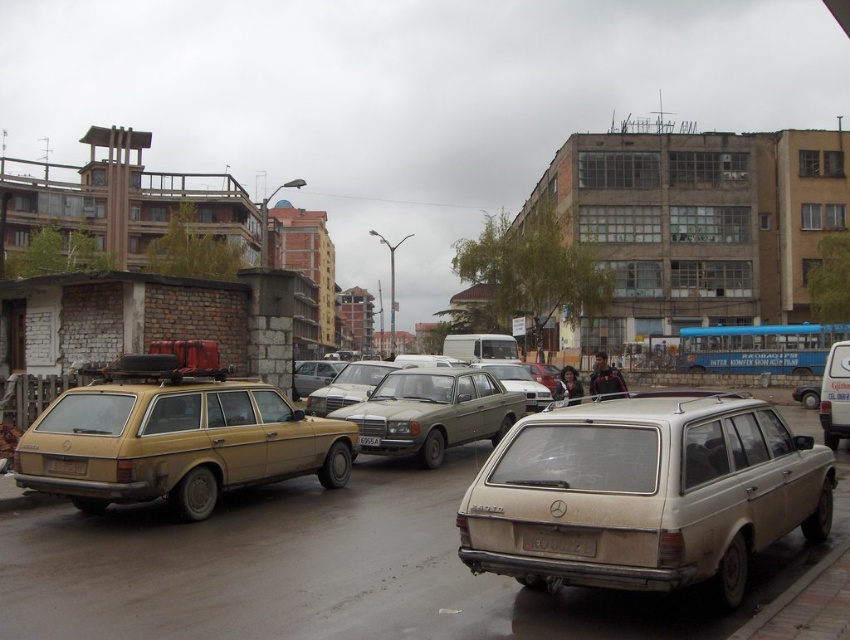
Looking at this image, who is higher up, black plastic license plate at center or metallic silver sedan at center?

black plastic license plate at center is higher up.

Can you confirm if black plastic license plate at center is positioned below metallic silver sedan at center?

Actually, black plastic license plate at center is above metallic silver sedan at center.

Image resolution: width=850 pixels, height=640 pixels. What are the coordinates of `black plastic license plate at center` in the screenshot? It's located at (558, 540).

Is green matte sedan at center shorter than silver metallic sedan at center?

Correct, green matte sedan at center is not as tall as silver metallic sedan at center.

In the scene shown: Is green matte sedan at center to the right of silver metallic sedan at center from the viewer's perspective?

Correct, you'll find green matte sedan at center to the right of silver metallic sedan at center.

Between point (364, 420) and point (303, 392), which one is positioned behind?

Positioned behind is point (303, 392).

Where is `green matte sedan at center`? Image resolution: width=850 pixels, height=640 pixels. green matte sedan at center is located at coordinates (434, 412).

Can you confirm if matte gray sedan at center is shorter than white plastic license plate at center?

Incorrect, matte gray sedan at center's height does not fall short of white plastic license plate at center's.

Can you confirm if matte gray sedan at center is positioned to the right of white plastic license plate at center?

In fact, matte gray sedan at center is to the left of white plastic license plate at center.

Where is `matte gray sedan at center`? This screenshot has height=640, width=850. matte gray sedan at center is located at coordinates (348, 385).